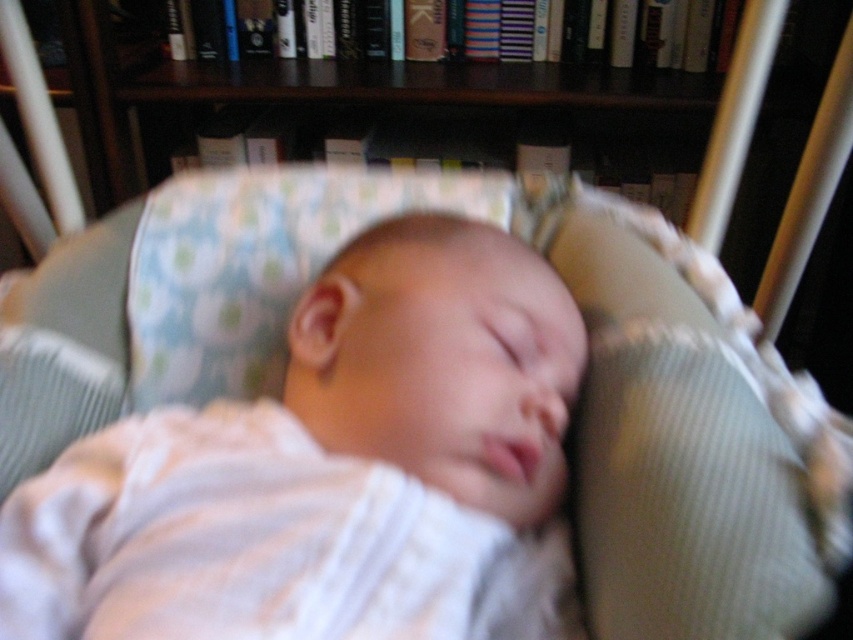
Which is in front, point (294, 404) or point (589, 612)?

Point (589, 612)

Who is more distant from viewer, (86, 547) or (778, 451)?

Point (86, 547)

In order to click on white knit fabric baby at center in this screenshot , I will do `click(332, 470)`.